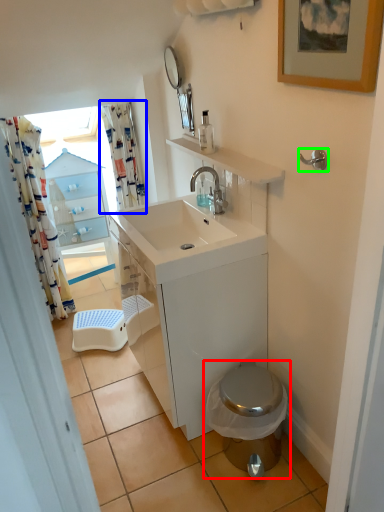
Question: Which object is positioned farthest from toilet (highlighted by a red box)? Select from shower curtain (highlighted by a blue box) and towel bar (highlighted by a green box).

Choices:
 (A) shower curtain
 (B) towel bar

Answer: (A)